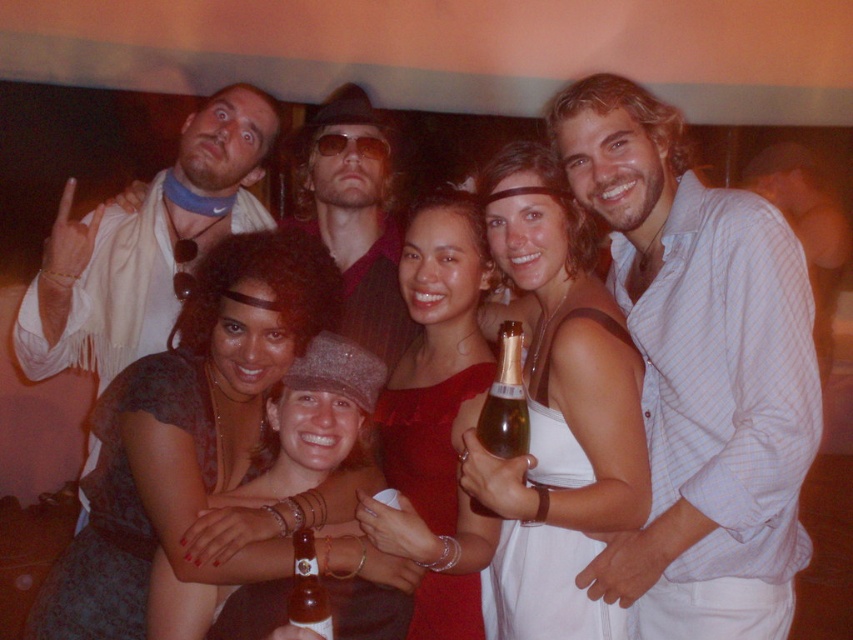
Question: Based on their relative distances, which object is farther from the white fabric dress at center?

Choices:
 (A) brown glass bottle at center
 (B) sunglasses at center
 (C) light blue striped shirt at center
 (D) dark brown textured dress at center

Answer: (A)

Question: Considering the real-world distances, which object is farthest from the matte red dress at center?

Choices:
 (A) matte black dress at center
 (B) light blue striped shirt at center
 (C) white fabric dress at center

Answer: (B)

Question: Considering the real-world distances, which object is farthest from the matte red dress at center?

Choices:
 (A) light blue striped shirt at center
 (B) dark brown textured dress at center
 (C) sunglasses at center

Answer: (A)

Question: Is the position of matte red dress at center more distant than that of sunglasses at center?

Choices:
 (A) no
 (B) yes

Answer: (A)

Question: Does matte red dress at center have a greater width compared to brown glass bottle at center?

Choices:
 (A) yes
 (B) no

Answer: (A)

Question: Is matte black dress at center to the left of brown glass bottle at center from the viewer's perspective?

Choices:
 (A) yes
 (B) no

Answer: (A)